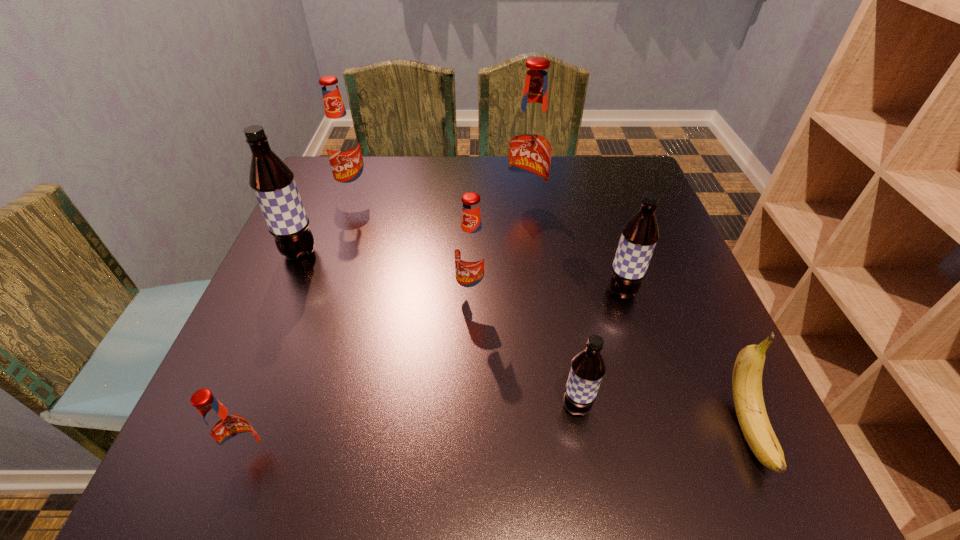
Select which red root beer appears as the closest to the second biggest brown root beer. Please provide its 2D coordinates. Your answer should be formatted as a tuple, i.e. [(x, y)], where the tuple contains the x and y coordinates of a point satisfying the conditions above.

[(530, 147)]

At what (x,y) coordinates should I click in order to perform the action: click on brown root beer that is the closest to the tallest root beer. Please return your answer as a coordinate pair (x, y). Looking at the image, I should click on pos(639,236).

Choose which brown root beer is the nearest neighbor to the fifth nearest root beer. Please provide its 2D coordinates. Your answer should be formatted as a tuple, i.e. [(x, y)], where the tuple contains the x and y coordinates of a point satisfying the conditions above.

[(587, 369)]

You are a GUI agent. You are given a task and a screenshot of the screen. Output one action in this format:
    pyautogui.click(x=<x>, y=<y>)
    Task: Click on the vacant area that satisfies the following two spatial constraints: 1. on the front side of the farthest brown root beer; 2. on the left side of the smallest red root beer
    The image size is (960, 540).
    Given the screenshot: What is the action you would take?
    pyautogui.click(x=211, y=458)